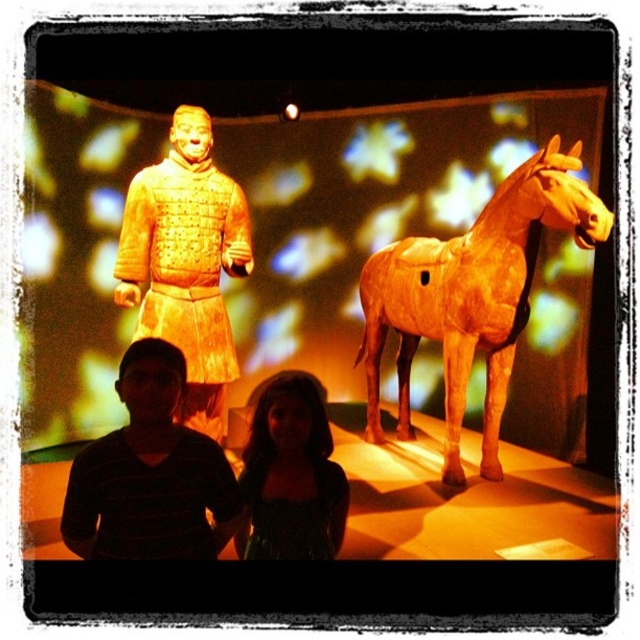
You are a photographer trying to capture a group photo of the black striped shirt at lower left and the dark green fabric dress at lower center. The camera frame can only accommodate one of them fully. Which person should you focus on to ensure their entire outfit fits within the frame?

The black striped shirt at lower left has a greater width than the dark green fabric dress at lower center. Therefore, focusing on the black striped shirt at lower left ensures their entire outfit fits within the camera frame since it is wider.

You are a tour guide explaining the statues in the display case to a visitor. You notice the matte gold horse at right and the black striped shirt at lower left. Which object is bigger in size?

The matte gold horse at right is larger in size than the black striped shirt at lower left.

You are a tour guide leading a group through a museum. You notice two visitors wearing a black striped shirt at lower left and a dark green fabric dress at lower center. The display case they are viewing has a warrior statue and a horse statue. To ensure safety, you need to know if the visitors are within the 12 inches safety zone around the display case. Are they within the safety zone?

The black striped shirt at lower left is 12.21 inches from the dark green fabric dress at lower center. Since the distance between them is slightly over 12 inches, they are just outside the 12 inches safety zone around the display case.